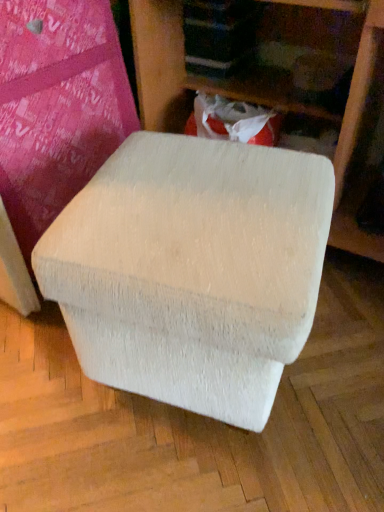
What are the coordinates of `vacant space situated above white textured bean bag at center (from a real-world perspective)` in the screenshot? It's located at (194, 194).